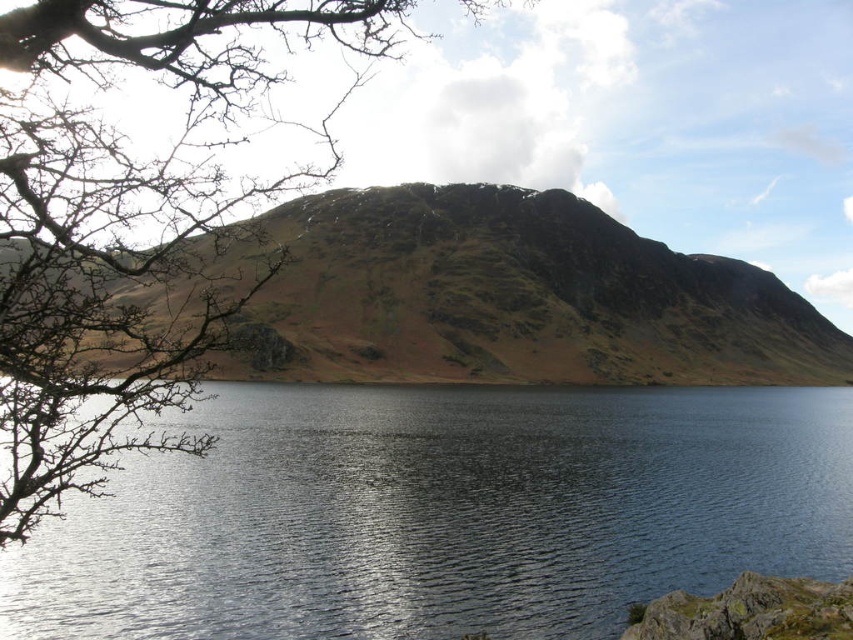
You are standing at the edge of the lake and want to locate the blue reflective water at center. According to the coordinates provided, in which direction should you look relative to your position?

The blue reflective water at center is located at coordinates point (444, 513), which means it is positioned slightly to the right and slightly above the center of the image. Since you are standing at the edge of the lake, you should look towards the central area of the lake, slightly to your right and a bit higher than the center point to locate it.

You are planning to take a photo of the brown rocky mountain at upper center from the location of the bare branches at left. Considering the distance between them, would you need a telephoto lens to capture the entire mountain in the frame?

The distance between the bare branches at left and the brown rocky mountain at upper center is 82.17 meters. To capture the entire mountain in the frame from that distance, a telephoto lens would be necessary to reduce the field of view and magnify the subject.

You are standing on the lakeshore and want to take a photo of the blue reflective water at center and the bare branches at left. Which object appears taller in the photo?

The bare branches at left appear taller because they are taller than the blue reflective water at center.